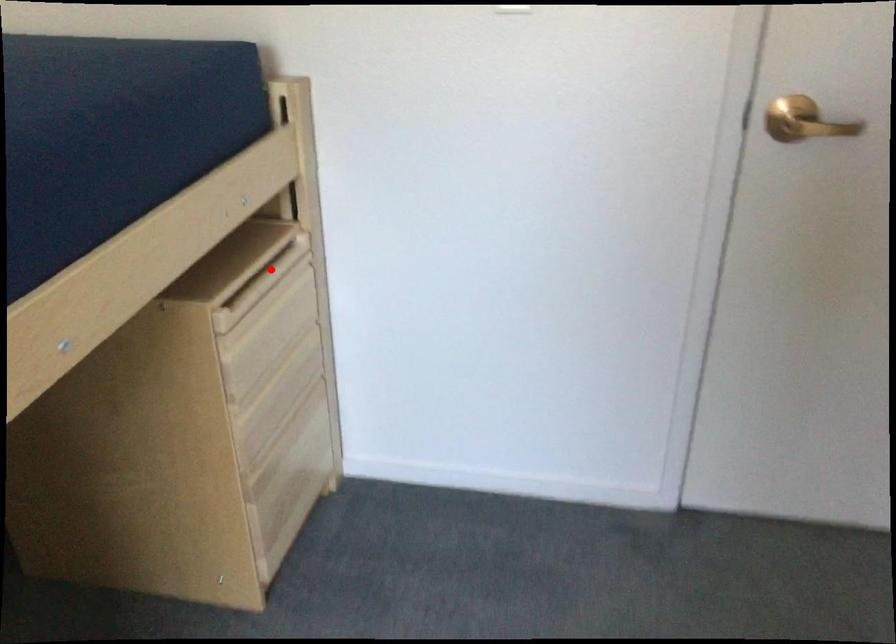
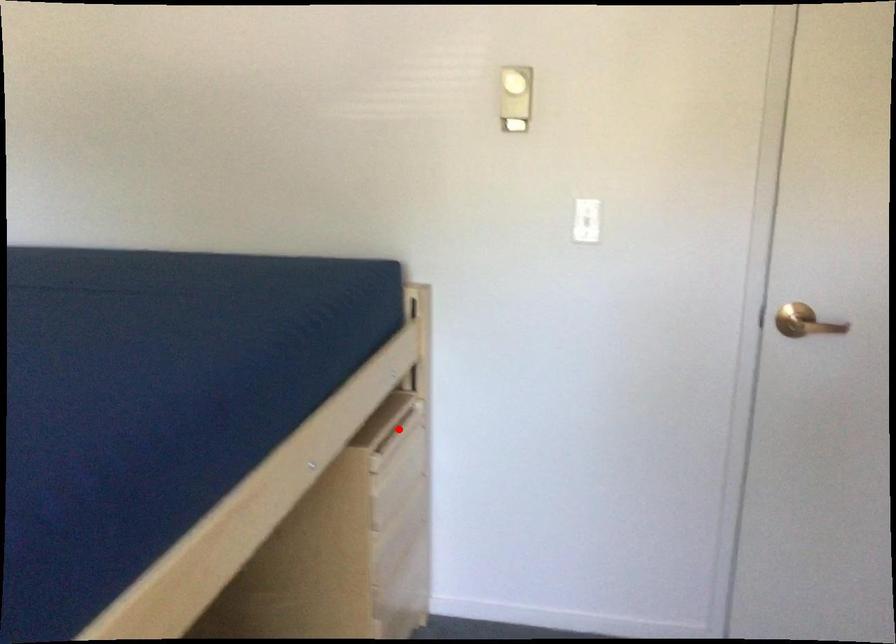
I am providing you with two images of the same scene from different viewpoints. A red point is marked on the first image and another point is marked on the second image. Do the highlighted points in image1 and image2 indicate the same real-world spot?

Yes